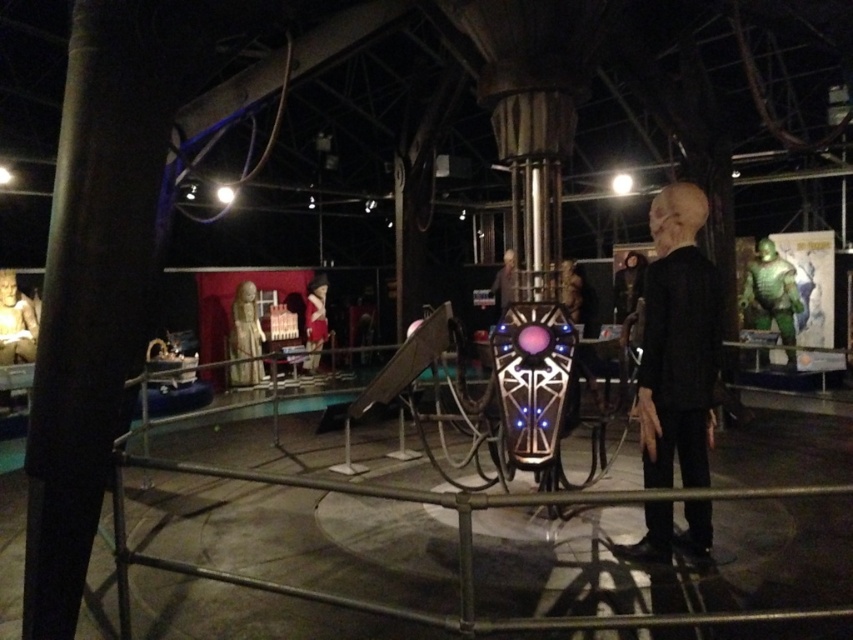
Question: Does smooth beige statue at left come in front of matte black alien at center?

Choices:
 (A) no
 (B) yes

Answer: (A)

Question: Does black matte alien at right have a smaller size compared to green metallic alien at right?

Choices:
 (A) yes
 (B) no

Answer: (A)

Question: Which point is closer to the camera?

Choices:
 (A) (248, 360)
 (B) (314, 333)

Answer: (A)

Question: Considering the real-world distances, which object is closest to the black matte alien at right?

Choices:
 (A) green metallic alien at right
 (B) matte gold statue at center
 (C) matte black alien at center
 (D) smooth beige statue at left

Answer: (C)

Question: Estimate the real-world distances between objects in this image. Which object is closer to the matte gold statue at center?

Choices:
 (A) matte black alien at center
 (B) black matte alien at right

Answer: (A)

Question: Does matte white statue at left lie in front of matte black alien at center?

Choices:
 (A) yes
 (B) no

Answer: (B)